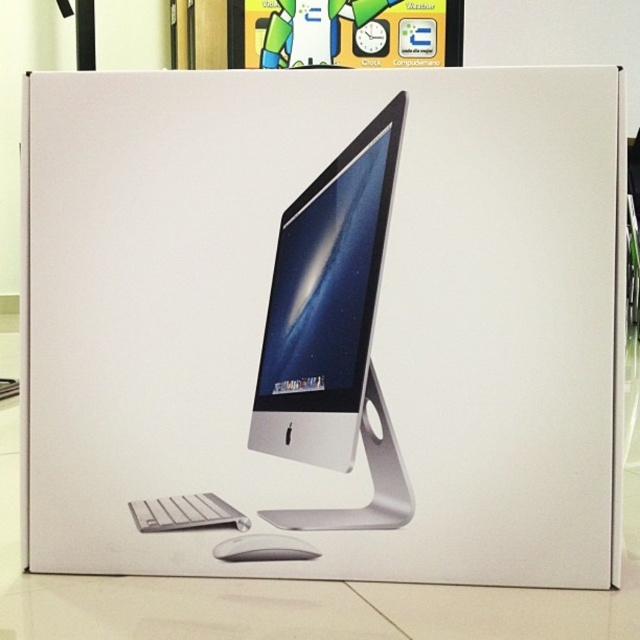
Is silver metallic computer monitor at center shorter than white plastic keyboard at lower left?

No, silver metallic computer monitor at center is not shorter than white plastic keyboard at lower left.

This screenshot has width=640, height=640. Identify the location of silver metallic computer monitor at center. (326, 301).

Where is `silver metallic computer monitor at center`? silver metallic computer monitor at center is located at coordinates (326, 301).

Who is more distant from viewer, (225, 509) or (282, 556)?

The point (282, 556) is more distant.

Does white plastic keyboard at lower left appear under white matte mouse at lower center?

Incorrect, white plastic keyboard at lower left is not positioned below white matte mouse at lower center.

Identify the location of white plastic keyboard at lower left. (186, 513).

Which is below, silver metallic computer monitor at center or white matte mouse at lower center?

white matte mouse at lower center is below.

Between silver metallic computer monitor at center and white matte mouse at lower center, which one has more height?

silver metallic computer monitor at center is taller.

What do you see at coordinates (326, 301) in the screenshot? This screenshot has height=640, width=640. I see `silver metallic computer monitor at center` at bounding box center [326, 301].

Where is `silver metallic computer monitor at center`? The width and height of the screenshot is (640, 640). silver metallic computer monitor at center is located at coordinates (326, 301).